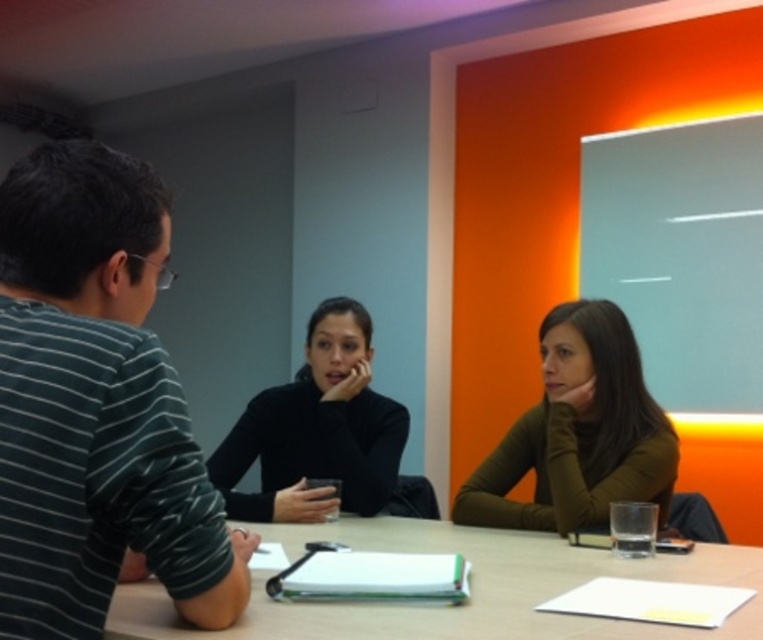
You are designing a new layout for a meeting room and need to place a rectangular desk that is 2 meters wide. The smooth wooden table at center and the black matte turtleneck at center are both in the way. Which object is wider and must be moved first to accommodate the desk?

The smooth wooden table at center is wider than the black matte turtleneck at center, so it must be moved first to accommodate the desk.

You are a tailor observing a person wearing both a matte green sweater at center and a black matte turtleneck at center. Which clothing item is visible on top?

The matte green sweater at center is positioned over the black matte turtleneck at center, so the matte green sweater at center is visible on top.

You are an interior designer assessing the seating arrangement in the meeting room. The striped cotton shirt at left and the black matte turtleneck at center are two key elements in the scene. Which of these items is narrower in width?

The striped cotton shirt at left is thinner than the black matte turtleneck at center, so the striped cotton shirt at left is narrower in width.